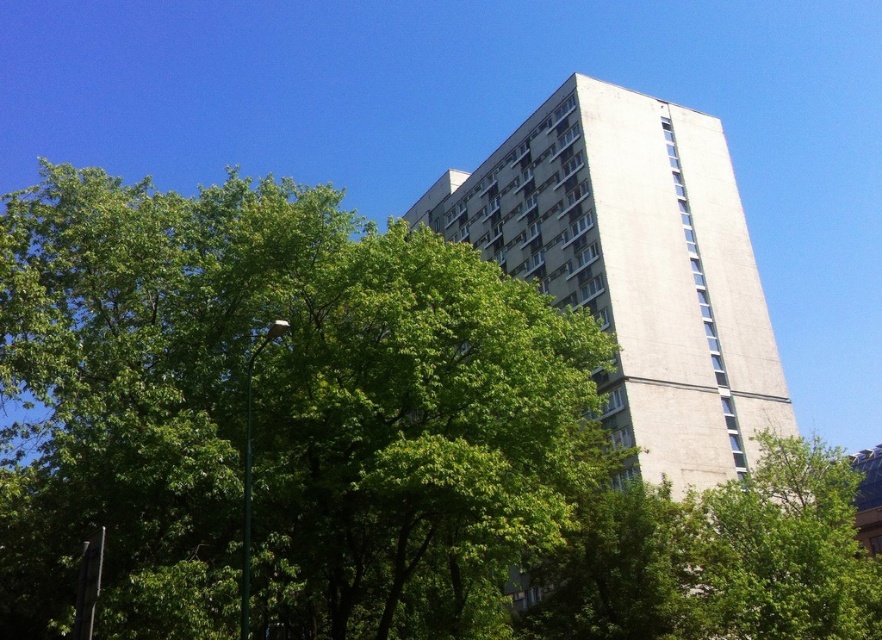
Does green leafy tree at center appear on the right side of white concrete building at center?

In fact, green leafy tree at center is to the left of white concrete building at center.

Describe the element at coordinates (277, 413) in the screenshot. I see `green leafy tree at center` at that location.

Describe the element at coordinates (277, 413) in the screenshot. I see `green leafy tree at center` at that location.

The image size is (882, 640). I want to click on green leafy tree at center, so click(277, 413).